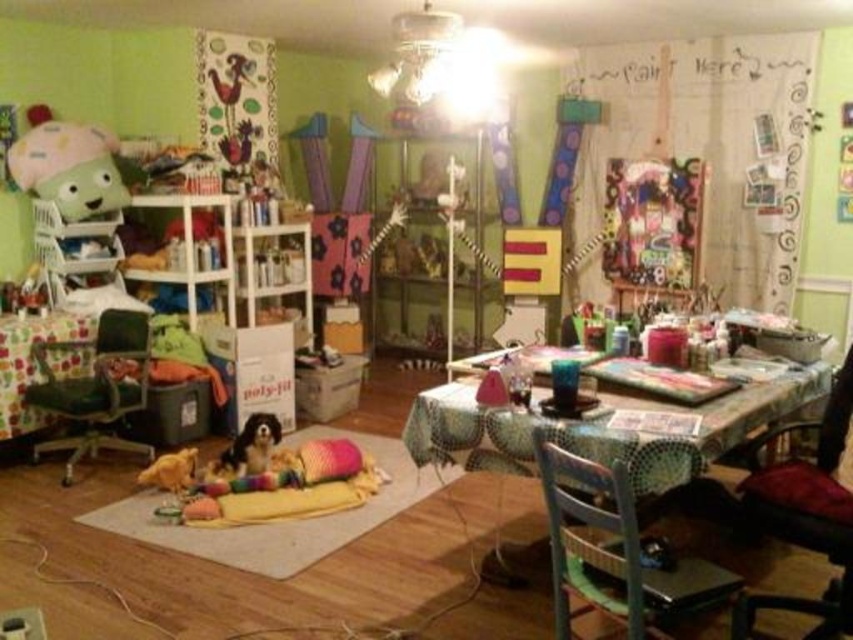
Who is positioned more to the right, patterned fabric table at center or black fur dog at lower center?

From the viewer's perspective, patterned fabric table at center appears more on the right side.

Which is above, patterned fabric table at center or black fur dog at lower center?

patterned fabric table at center is above.

Describe the element at coordinates (700, 413) in the screenshot. This screenshot has height=640, width=853. I see `patterned fabric table at center` at that location.

This screenshot has height=640, width=853. I want to click on patterned fabric table at center, so click(700, 413).

Is point (799, 401) closer to viewer compared to point (602, 557)?

That is False.

Between patterned fabric table at center and wooden chair at lower right, which one appears on the right side from the viewer's perspective?

From the viewer's perspective, patterned fabric table at center appears more on the right side.

Which is behind, point (453, 444) or point (599, 568)?

Point (453, 444)

Locate an element on the screen. The image size is (853, 640). patterned fabric table at center is located at coordinates (700, 413).

Does point (70, 388) lie behind point (252, 428)?

Yes, point (70, 388) is farther from viewer.

Which is more to the right, green fabric office chair at left or black fur dog at lower center?

Positioned to the right is black fur dog at lower center.

Find the location of a particular element. green fabric office chair at left is located at coordinates (96, 388).